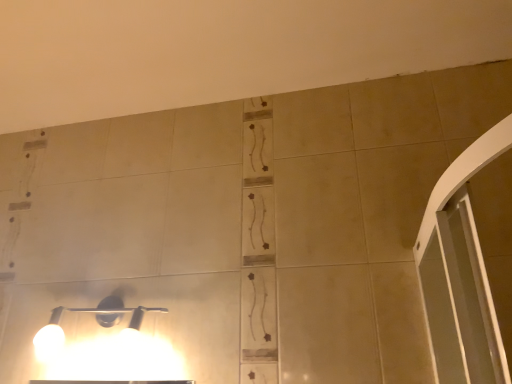
Image resolution: width=512 pixels, height=384 pixels. Describe the element at coordinates (98, 322) in the screenshot. I see `matte black light fixture at lower left` at that location.

The height and width of the screenshot is (384, 512). Find the location of `matte black light fixture at lower left`. matte black light fixture at lower left is located at coordinates (98, 322).

Image resolution: width=512 pixels, height=384 pixels. I want to click on matte black light fixture at lower left, so click(98, 322).